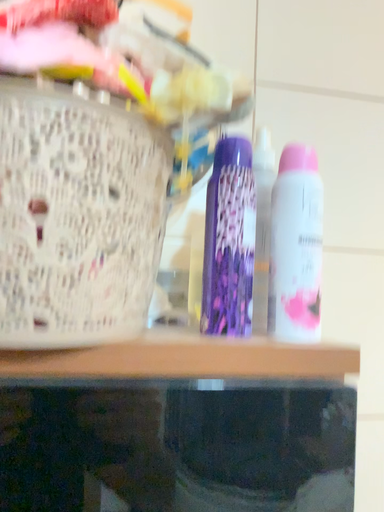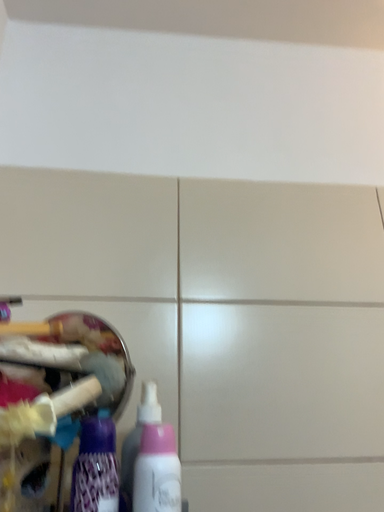
Question: How did the camera likely rotate when shooting the video?

Choices:
 (A) rotated downward
 (B) rotated upward

Answer: (B)